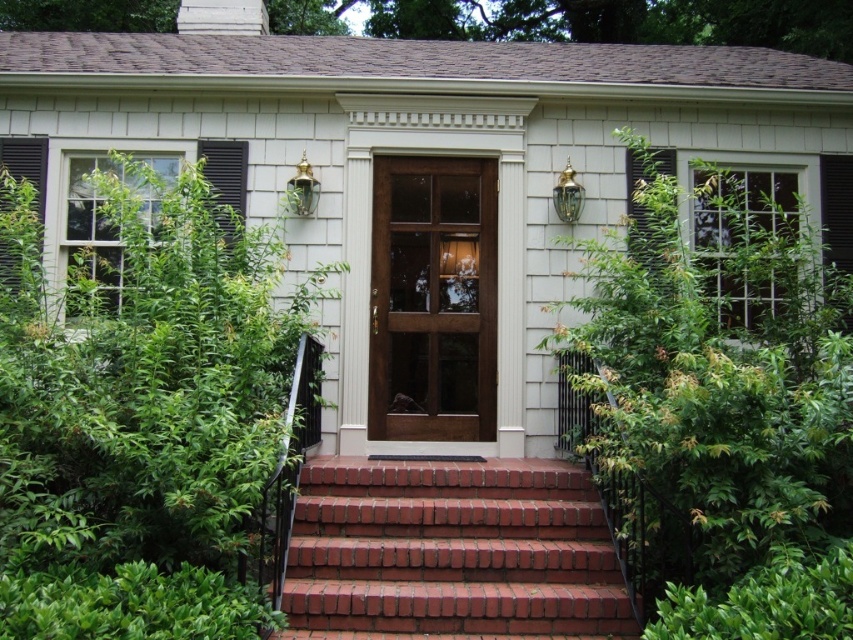
Is green leafy bush at right below red brick stairs at center?

Incorrect, green leafy bush at right is not positioned below red brick stairs at center.

Does green leafy bush at right have a lesser height compared to red brick stairs at center?

No, green leafy bush at right is not shorter than red brick stairs at center.

Is point (604, 477) more distant than point (376, 532)?

No.

You are a GUI agent. You are given a task and a screenshot of the screen. Output one action in this format:
    pyautogui.click(x=<x>, y=<y>)
    Task: Click on the green leafy bush at right
    
    Given the screenshot: What is the action you would take?
    pyautogui.click(x=720, y=412)

Looking at this image, can you confirm if red brick stairs at center is shorter than glossy wood door at center?

Indeed, red brick stairs at center has a lesser height compared to glossy wood door at center.

Can you confirm if red brick stairs at center is wider than glossy wood door at center?

Yes, red brick stairs at center is wider than glossy wood door at center.

Which is in front, point (534, 625) or point (445, 216)?

Point (534, 625)

You are a GUI agent. You are given a task and a screenshot of the screen. Output one action in this format:
    pyautogui.click(x=<x>, y=<y>)
    Task: Click on the red brick stairs at center
    The height and width of the screenshot is (640, 853).
    Given the screenshot: What is the action you would take?
    pyautogui.click(x=451, y=554)

Which is above, green leafy plant at left or glossy wood door at center?

glossy wood door at center is higher up.

Who is taller, green leafy plant at left or glossy wood door at center?

With more height is green leafy plant at left.

Who is more forward, (233, 424) or (466, 248)?

Positioned in front is point (233, 424).

Locate an element on the screen. This screenshot has height=640, width=853. green leafy plant at left is located at coordinates (141, 417).